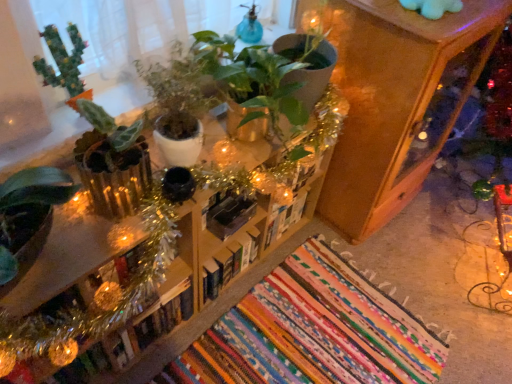
Question: From their relative heights in the image, would you say green matte cactus at upper left, which is the first houseplant from left to right, is taller or shorter than wooden bookshelf at center?

Choices:
 (A) tall
 (B) short

Answer: (B)

Question: Is green matte cactus at upper left, which is the first houseplant from left to right, in front of or behind wooden bookshelf at center in the image?

Choices:
 (A) front
 (B) behind

Answer: (B)

Question: Which object is the closest to the hardcover book at center, the first book in the left-to-right sequence?

Choices:
 (A) green matte plant at center, which ranks as the 2th houseplant in left-to-right order
 (B) wooden cabinet at upper right
 (C) green matte cactus at upper left, which is the first houseplant from left to right
 (D) black matte bookshelf at center, the second book positioned from the right
 (E) hardcover book at center, arranged as the second book when viewed from the left

Answer: (E)

Question: Considering the real-world distances, which object is farthest from the wooden cabinet at upper right?

Choices:
 (A) hardcover book at center, arranged as the second book when viewed from the left
 (B) wooden bookshelf at center
 (C) green matte plant at center, which is the first houseplant in right-to-left order
 (D) green matte cactus at upper left, positioned as the second houseplant in right-to-left order
 (E) hardcover book at center, the first book in the left-to-right sequence

Answer: (D)